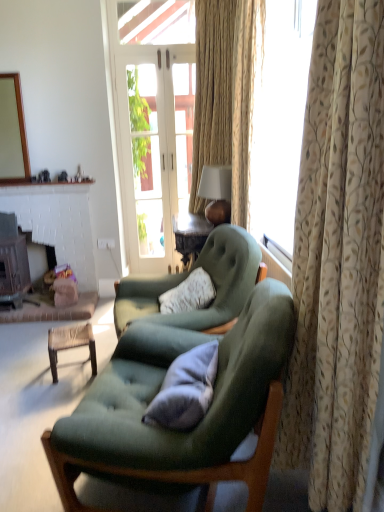
Locate an element on the screen. woven brown stool at lower left is located at coordinates (70, 344).

This screenshot has width=384, height=512. Describe the element at coordinates (182, 432) in the screenshot. I see `velvet green sofa at center, placed as the 1th chair when sorted from front to back` at that location.

In order to face matte gold lampshade at center, should I rotate leftwards or rightwards?

A 3.377 degree turn to the right will do.

In order to click on gray fabric pillow at center in this screenshot , I will do `click(185, 390)`.

Locate an element on the screen. beige floral fabric curtain at right, which is the first curtain from front to back is located at coordinates (338, 258).

In order to face velvet green armchair at center, arranged as the second chair when viewed from the front, should I rotate leftwards or rightwards?

Turn left by 1.592 degrees to look at velvet green armchair at center, arranged as the second chair when viewed from the front.

Identify the location of woven brown stool at lower left. click(70, 344).

Which object is positioned more to the left, gray fabric pillow at center or dark brown wood fireplace at left, the 1th fireplace from the left?

From the viewer's perspective, dark brown wood fireplace at left, the 1th fireplace from the left, appears more on the left side.

Are gray fabric pillow at center and dark brown wood fireplace at left, the 2th fireplace viewed from the right, located far from each other?

Indeed, gray fabric pillow at center is not near dark brown wood fireplace at left, the 2th fireplace viewed from the right.

Is gray fabric pillow at center positioned before dark brown wood fireplace at left, the 2th fireplace viewed from the right?

Yes, it is.

Considering the sizes of objects velvet green armchair at center, the 1th chair positioned from the back, and woven brown stool at lower left in the image provided, who is wider, velvet green armchair at center, the 1th chair positioned from the back, or woven brown stool at lower left?

velvet green armchair at center, the 1th chair positioned from the back.

Between velvet green armchair at center, arranged as the second chair when viewed from the front, and woven brown stool at lower left, which one is positioned in front?

velvet green armchair at center, arranged as the second chair when viewed from the front, is in front.

Where is `stool that appears below the velvet green armchair at center, arranged as the second chair when viewed from the front (from the image's perspective)`? The height and width of the screenshot is (512, 384). stool that appears below the velvet green armchair at center, arranged as the second chair when viewed from the front (from the image's perspective) is located at coordinates (70, 344).

Is gray fabric pillow at center turned away from beige textured curtain at right, marked as the second curtain in a front-to-back arrangement?

No, gray fabric pillow at center is not facing away from beige textured curtain at right, marked as the second curtain in a front-to-back arrangement.

Is gray fabric pillow at center taller or shorter than beige textured curtain at right, marked as the second curtain in a front-to-back arrangement?

gray fabric pillow at center is shorter than beige textured curtain at right, marked as the second curtain in a front-to-back arrangement.

Is gray fabric pillow at center positioned before beige textured curtain at right, marked as the second curtain in a front-to-back arrangement?

Yes, gray fabric pillow at center is in front of beige textured curtain at right, marked as the second curtain in a front-to-back arrangement.

Could you measure the distance between gray fabric pillow at center and beige textured curtain at right, the first curtain in the back-to-front sequence?

They are 2.34 meters apart.

Which of these two, green matte mirror at upper left or gray fabric pillow at center, stands shorter?

gray fabric pillow at center is shorter.

Could you tell me if green matte mirror at upper left is facing gray fabric pillow at center?

No, green matte mirror at upper left is not facing towards gray fabric pillow at center.

Is green matte mirror at upper left positioned far away from gray fabric pillow at center?

green matte mirror at upper left is far away from gray fabric pillow at center.

From a real-world perspective, which object rests below the other?

In real-world perspective, velvet green sofa at center, the 2th chair positioned from the back, is lower.

Between velvet green sofa at center, the 2th chair positioned from the back, and gray fabric pillow at center, which one has larger width?

Wider between the two is velvet green sofa at center, the 2th chair positioned from the back.

From the picture: Is velvet green sofa at center, placed as the 1th chair when sorted from front to back, inside or outside of gray fabric pillow at center?

velvet green sofa at center, placed as the 1th chair when sorted from front to back, cannot be found inside gray fabric pillow at center.

Does velvet green sofa at center, placed as the 1th chair when sorted from front to back, touch gray fabric pillow at center?

No, velvet green sofa at center, placed as the 1th chair when sorted from front to back, is not touching gray fabric pillow at center.

Which object is closer to the camera, white plastic power outlet at lower center or beige textured curtain at right, marked as the second curtain in a front-to-back arrangement?

beige textured curtain at right, marked as the second curtain in a front-to-back arrangement, is closer to the camera.

Between white plastic power outlet at lower center and beige textured curtain at right, marked as the second curtain in a front-to-back arrangement, which one has less height?

white plastic power outlet at lower center.

Does white plastic power outlet at lower center have a greater width compared to beige textured curtain at right, marked as the second curtain in a front-to-back arrangement?

No.

Is white plastic power outlet at lower center placed right next to beige textured curtain at right, the first curtain in the back-to-front sequence?

No, white plastic power outlet at lower center is not making contact with beige textured curtain at right, the first curtain in the back-to-front sequence.

Can you confirm if velvet green armchair at center, arranged as the second chair when viewed from the front, is smaller than white plastic power outlet at lower center?

No.

From the image's perspective, would you say velvet green armchair at center, arranged as the second chair when viewed from the front, is positioned over white plastic power outlet at lower center?

No, from the image's perspective, velvet green armchair at center, arranged as the second chair when viewed from the front, is not above white plastic power outlet at lower center.

Is velvet green armchair at center, the 1th chair positioned from the back, wider than white plastic power outlet at lower center?

Indeed, velvet green armchair at center, the 1th chair positioned from the back, has a greater width compared to white plastic power outlet at lower center.

Between velvet green armchair at center, the 1th chair positioned from the back, and white plastic power outlet at lower center, which one appears on the right side from the viewer's perspective?

From the viewer's perspective, velvet green armchair at center, the 1th chair positioned from the back, appears more on the right side.

At what (x,y) coordinates should I click in order to perform the action: click on pillow located above the dark brown wood fireplace at left, the 1th fireplace from the left (from a real-world perspective). Please return your answer as a coordinate pair (x, y). This screenshot has height=512, width=384. Looking at the image, I should click on (185, 390).

Find the location of a particular element. The image size is (384, 512). the 1st chair to the right of the woven brown stool at lower left, starting your count from the anchor is located at coordinates (186, 278).

Estimate the real-world distances between objects in this image. Which object is further from green matte mirror at upper left, white brick fireplace at lower left, the first fireplace in the right-to-left sequence, or beige floral fabric curtain at right, which appears as the 2th curtain when viewed from the back?

beige floral fabric curtain at right, which appears as the 2th curtain when viewed from the back, is further to green matte mirror at upper left.

Looking at the image, which one is located further to clear glass door at center, dark brown wood fireplace at left, the 1th fireplace from the left, or gray fabric pillow at center?

gray fabric pillow at center.

When comparing their distances from matte gold lampshade at center, does white brick fireplace at lower left, the first fireplace in the right-to-left sequence, or velvet green sofa at center, placed as the 1th chair when sorted from front to back, seem closer?

Based on the image, white brick fireplace at lower left, the first fireplace in the right-to-left sequence, appears to be nearer to matte gold lampshade at center.

Based on the photo, based on their spatial positions, is dark brown wood fireplace at left, the 2th fireplace viewed from the right, or gray fabric pillow at center further from white brick fireplace at lower left, placed as the second fireplace when sorted from left to right?

The object further to white brick fireplace at lower left, placed as the second fireplace when sorted from left to right, is gray fabric pillow at center.

From the image, which object appears to be nearer to velvet green sofa at center, the 2th chair positioned from the back, dark brown wood fireplace at left, the 1th fireplace from the left, or beige floral fabric curtain at right, which appears as the 2th curtain when viewed from the back?

beige floral fabric curtain at right, which appears as the 2th curtain when viewed from the back, is positioned closer to the anchor velvet green sofa at center, the 2th chair positioned from the back.

When comparing their distances from beige textured curtain at right, the first curtain in the back-to-front sequence, does clear glass door at center or dark brown wood fireplace at left, the 2th fireplace viewed from the right, seem further?

The object further to beige textured curtain at right, the first curtain in the back-to-front sequence, is dark brown wood fireplace at left, the 2th fireplace viewed from the right.

When comparing their distances from woven brown stool at lower left, does dark brown wood fireplace at left, the 2th fireplace viewed from the right, or velvet green sofa at center, the 2th chair positioned from the back, seem closer?

dark brown wood fireplace at left, the 2th fireplace viewed from the right, is positioned closer to the anchor woven brown stool at lower left.

Estimate the real-world distances between objects in this image. Which object is closer to dark brown wood fireplace at left, the 2th fireplace viewed from the right, green matte mirror at upper left or beige floral fabric curtain at right, which is the first curtain from front to back?

green matte mirror at upper left is positioned closer to the anchor dark brown wood fireplace at left, the 2th fireplace viewed from the right.

You are a GUI agent. You are given a task and a screenshot of the screen. Output one action in this format:
    pyautogui.click(x=<x>, y=<y>)
    Task: Click on the stool positioned between beige floral fabric curtain at right, which is the first curtain from front to back, and green matte mirror at upper left from near to far
    The height and width of the screenshot is (512, 384).
    Given the screenshot: What is the action you would take?
    coord(70,344)

In order to click on fireplace between green matte mirror at upper left and clear glass door at center in this screenshot , I will do `click(56, 242)`.

You are a GUI agent. You are given a task and a screenshot of the screen. Output one action in this format:
    pyautogui.click(x=<x>, y=<y>)
    Task: Click on the mirror between gray fabric pillow at center and dark brown wood fireplace at left, the 1th fireplace from the left, along the z-axis
    The height and width of the screenshot is (512, 384).
    Given the screenshot: What is the action you would take?
    pyautogui.click(x=13, y=132)

Locate an element on the screen. The width and height of the screenshot is (384, 512). lamp positioned between velvet green sofa at center, the 2th chair positioned from the back, and dark brown wood fireplace at left, the 2th fireplace viewed from the right, from near to far is located at coordinates (216, 193).